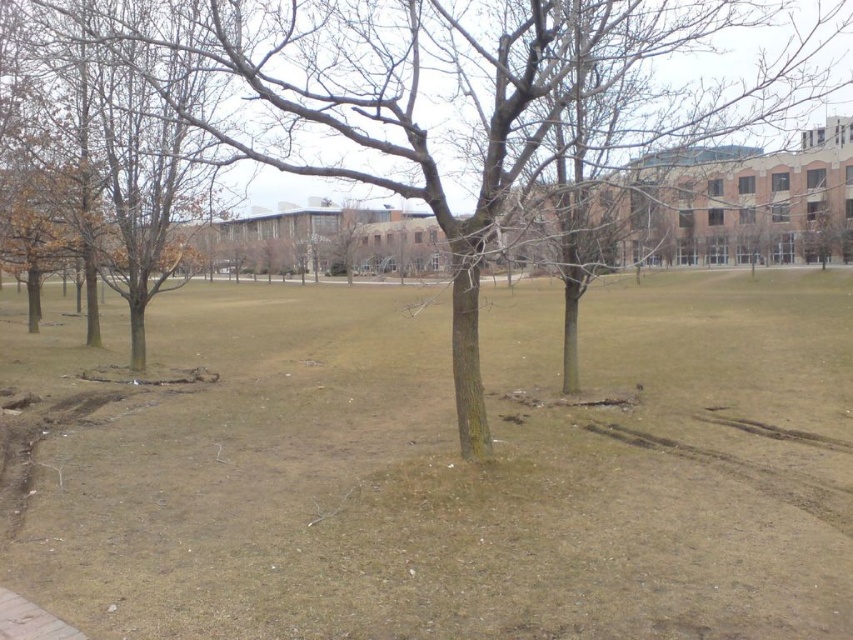
You are standing at the point marked as point (466,474) in the image. What do you see directly under your feet?

You see brown dry grass at center directly under your feet at point (466,474).

You are standing in the open grassy area and want to walk from the brown bark tree at center to the brown dry grass at center. Which direction should you face before stepping forward?

You should face to the right because the brown dry grass at center is located to the right of the brown bark tree at center.